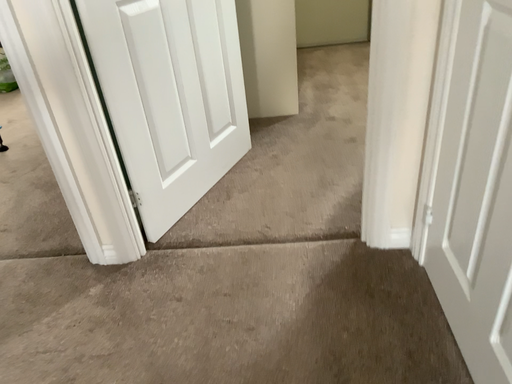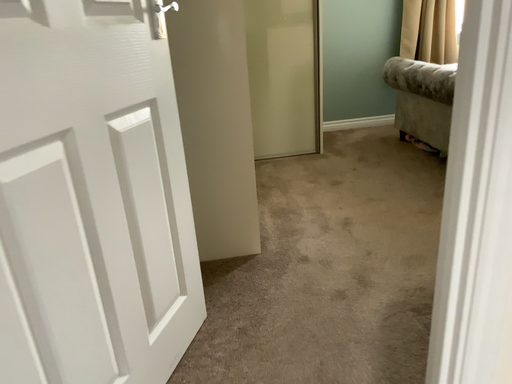
Question: Which way did the camera rotate in the video?

Choices:
 (A) rotated downward
 (B) rotated upward

Answer: (B)